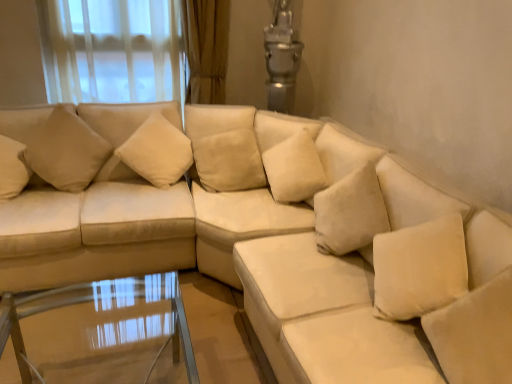
Where is `beige fabric pillow at upper left, positioned as the second pillow in left-to-right order`? beige fabric pillow at upper left, positioned as the second pillow in left-to-right order is located at coordinates (157, 151).

What is the approximate height of beige fabric pillow at upper left, arranged as the 3th pillow when viewed from the right?

23.54 inches.

What do you see at coordinates (94, 231) in the screenshot? The height and width of the screenshot is (384, 512). I see `suede beige couch at left` at bounding box center [94, 231].

The width and height of the screenshot is (512, 384). I want to click on beige fabric pillow at center, placed as the 3th pillow when sorted from left to right, so click(225, 147).

I want to click on beige fabric pillow at upper left, which is the first pillow in left-to-right order, so click(66, 151).

Consider the image. Between suede beige couch at left and beige fabric pillow at upper left, arranged as the 3th pillow when viewed from the right, which one has less height?

beige fabric pillow at upper left, arranged as the 3th pillow when viewed from the right, is shorter.

Can you confirm if suede beige couch at left is bigger than beige fabric pillow at upper left, positioned as the second pillow in left-to-right order?

Correct, suede beige couch at left is larger in size than beige fabric pillow at upper left, positioned as the second pillow in left-to-right order.

How different are the orientations of suede beige couch at left and beige fabric pillow at upper left, arranged as the 3th pillow when viewed from the right, in degrees?

The facing directions of suede beige couch at left and beige fabric pillow at upper left, arranged as the 3th pillow when viewed from the right, are 2.01 degrees apart.

Looking at this image, from the image's perspective, between suede beige couch at left and beige fabric pillow at upper left, positioned as the second pillow in left-to-right order, who is located below?

suede beige couch at left is shown below in the image.

Which is in front, point (238, 163) or point (151, 130)?

The point (238, 163) is in front.

From the image's perspective, starting from the beige fabric pillow at upper left, arranged as the 3th pillow when viewed from the right, which pillow is the 2nd one below? Please provide its 2D coordinates.

[(225, 147)]

Between beige fabric pillow at center, placed as the 3th pillow when sorted from left to right, and beige fabric pillow at upper left, arranged as the 3th pillow when viewed from the right, which one appears on the right side from the viewer's perspective?

beige fabric pillow at center, placed as the 3th pillow when sorted from left to right, is more to the right.

Is beige fabric pillow at center, which is the second pillow in right-to-left order, shorter than beige fabric pillow at upper left, positioned as the second pillow in left-to-right order?

Yes, beige fabric pillow at center, which is the second pillow in right-to-left order, is shorter than beige fabric pillow at upper left, positioned as the second pillow in left-to-right order.

Could you tell me if suede beige couch at left is facing soft white pillow at lower right, the fourth pillow in the left-to-right sequence?

No, suede beige couch at left is not oriented towards soft white pillow at lower right, the fourth pillow in the left-to-right sequence.

In the scene shown: Can you confirm if suede beige couch at left is wider than soft white pillow at lower right, the fourth pillow in the left-to-right sequence?

Yes, suede beige couch at left is wider than soft white pillow at lower right, the fourth pillow in the left-to-right sequence.

Is suede beige couch at left beside soft white pillow at lower right, the fourth pillow in the left-to-right sequence?

suede beige couch at left and soft white pillow at lower right, the fourth pillow in the left-to-right sequence, are not in contact.

From a real-world perspective, who is located lower, beige fabric pillow at upper left, positioned as the second pillow in left-to-right order, or suede beige couch at left?

suede beige couch at left.

From the image's perspective, is beige fabric pillow at upper left, arranged as the 3th pillow when viewed from the right, beneath suede beige couch at left?

No, from the image's perspective, beige fabric pillow at upper left, arranged as the 3th pillow when viewed from the right, is not below suede beige couch at left.

From the image's perspective, is beige fabric pillow at center, placed as the 3th pillow when sorted from left to right, positioned above or below beige fabric pillow at upper left, which is the first pillow in left-to-right order?

Based on their image positions, beige fabric pillow at center, placed as the 3th pillow when sorted from left to right, is located beneath beige fabric pillow at upper left, which is the first pillow in left-to-right order.

Considering the relative sizes of beige fabric pillow at center, placed as the 3th pillow when sorted from left to right, and beige fabric pillow at upper left, the 4th pillow when ordered from right to left, in the image provided, is beige fabric pillow at center, placed as the 3th pillow when sorted from left to right, taller than beige fabric pillow at upper left, the 4th pillow when ordered from right to left,?

No.

Is beige fabric pillow at center, which is the second pillow in right-to-left order, far away from beige fabric pillow at upper left, which is the first pillow in left-to-right order?

No, beige fabric pillow at center, which is the second pillow in right-to-left order, is not far from beige fabric pillow at upper left, which is the first pillow in left-to-right order.

Is beige fabric pillow at upper left, which is the first pillow in left-to-right order, aimed at suede beige couch at left?

Yes, beige fabric pillow at upper left, which is the first pillow in left-to-right order, is facing suede beige couch at left.

Consider the image. Does beige fabric pillow at upper left, the 4th pillow when ordered from right to left, have a greater height compared to suede beige couch at left?

In fact, beige fabric pillow at upper left, the 4th pillow when ordered from right to left, may be shorter than suede beige couch at left.

From the picture: Considering the positions of objects beige fabric pillow at upper left, which is the first pillow in left-to-right order, and suede beige couch at left in the image provided, who is behind, beige fabric pillow at upper left, which is the first pillow in left-to-right order, or suede beige couch at left?

beige fabric pillow at upper left, which is the first pillow in left-to-right order.

Looking at this image, from a real-world perspective, is beige fabric pillow at upper left, which is the first pillow in left-to-right order, beneath suede beige couch at left?

No.

Which object is positioned more to the right, beige fabric pillow at center, placed as the 3th pillow when sorted from left to right, or soft white pillow at lower right, the fourth pillow in the left-to-right sequence?

Positioned to the right is soft white pillow at lower right, the fourth pillow in the left-to-right sequence.

Considering the sizes of objects beige fabric pillow at center, which is the second pillow in right-to-left order, and soft white pillow at lower right, the fourth pillow in the left-to-right sequence, in the image provided, who is shorter, beige fabric pillow at center, which is the second pillow in right-to-left order, or soft white pillow at lower right, the fourth pillow in the left-to-right sequence,?

Standing shorter between the two is beige fabric pillow at center, which is the second pillow in right-to-left order.

From a real-world perspective, which is physically below, beige fabric pillow at center, placed as the 3th pillow when sorted from left to right, or soft white pillow at lower right, the 1th pillow from the right?

beige fabric pillow at center, placed as the 3th pillow when sorted from left to right.

This screenshot has width=512, height=384. I want to click on couch lying on the left of beige fabric pillow at upper left, arranged as the 3th pillow when viewed from the right, so click(94, 231).

From the beige fabric pillow at center, which is the second pillow in right-to-left order, count 1st pillows forward and point to it. Please provide its 2D coordinates.

[(157, 151)]

From the image, which object appears to be nearer to beige fabric pillow at upper left, which is the first pillow in left-to-right order, suede beige couch at left or beige fabric pillow at center, which is the second pillow in right-to-left order?

Based on the image, suede beige couch at left appears to be nearer to beige fabric pillow at upper left, which is the first pillow in left-to-right order.

Estimate the real-world distances between objects in this image. Which object is closer to beige fabric pillow at center, which is the second pillow in right-to-left order, transparent glass table at lower center or beige fabric pillow at upper left, the 4th pillow when ordered from right to left?

beige fabric pillow at upper left, the 4th pillow when ordered from right to left.

From the image, which object appears to be farther from suede beige couch at left, beige fabric pillow at upper left, which is the first pillow in left-to-right order, or transparent glass table at lower center?

Based on the image, transparent glass table at lower center appears to be further to suede beige couch at left.

When comparing their distances from transparent glass table at lower center, does beige fabric pillow at upper left, positioned as the second pillow in left-to-right order, or soft white pillow at lower right, the fourth pillow in the left-to-right sequence, seem further?

soft white pillow at lower right, the fourth pillow in the left-to-right sequence, lies further to transparent glass table at lower center than the other object.

When comparing their distances from beige fabric pillow at upper left, positioned as the second pillow in left-to-right order, does transparent glass table at lower center or soft white pillow at lower right, the 1th pillow from the right, seem closer?

transparent glass table at lower center.

Looking at the image, which one is located further to beige fabric pillow at center, placed as the 3th pillow when sorted from left to right, suede beige couch at left or beige fabric pillow at upper left, positioned as the second pillow in left-to-right order?

suede beige couch at left.

Estimate the real-world distances between objects in this image. Which object is closer to transparent glass table at lower center, beige fabric pillow at center, which is the second pillow in right-to-left order, or suede beige couch at left?

suede beige couch at left is positioned closer to the anchor transparent glass table at lower center.

Estimate the real-world distances between objects in this image. Which object is closer to transparent glass table at lower center, beige fabric pillow at upper left, positioned as the second pillow in left-to-right order, or suede beige couch at left?

suede beige couch at left.

In order to click on pillow between suede beige couch at left and beige fabric pillow at center, which is the second pillow in right-to-left order in this screenshot , I will do `click(157, 151)`.

This screenshot has height=384, width=512. Identify the location of couch situated between beige fabric pillow at upper left, which is the first pillow in left-to-right order, and beige fabric pillow at upper left, arranged as the 3th pillow when viewed from the right, from left to right. (94, 231).

I want to click on pillow between beige fabric pillow at upper left, the 4th pillow when ordered from right to left, and beige fabric pillow at center, placed as the 3th pillow when sorted from left to right, from left to right, so click(157, 151).

Locate an element on the screen. couch between transparent glass table at lower center and beige fabric pillow at upper left, the 4th pillow when ordered from right to left, from front to back is located at coordinates (94, 231).